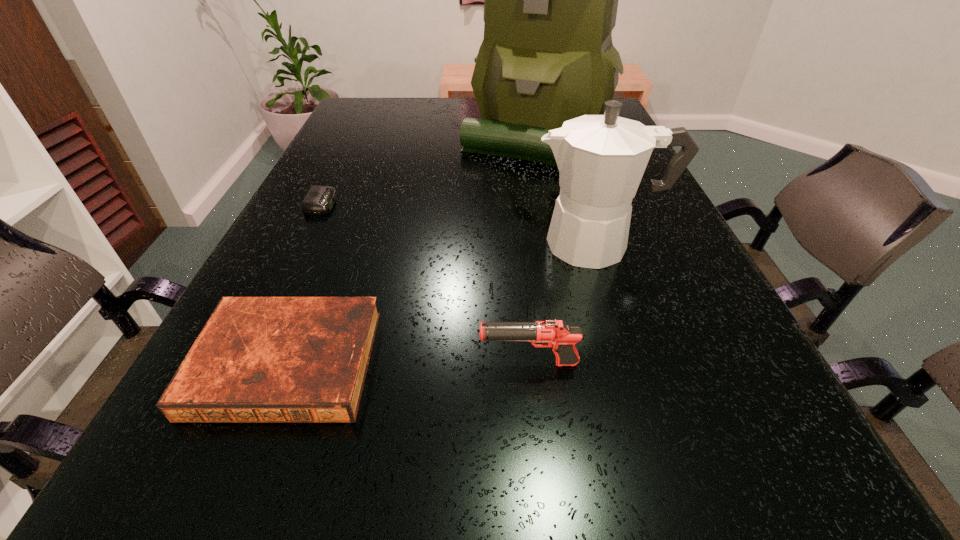
Locate an element on the screen. This screenshot has width=960, height=540. vacant area located at the spout of the third farthest object is located at coordinates (491, 244).

Locate an element on the screen. This screenshot has width=960, height=540. free space located 0.120m at the spout of the third farthest object is located at coordinates (470, 244).

I want to click on vacant space located at the aiming end of the third tallest object, so click(x=324, y=363).

Find the location of a particular element. This screenshot has height=540, width=960. vacant space located 0.160m at the aiming end of the third tallest object is located at coordinates (372, 363).

Locate an element on the screen. vacant area situated at the aiming end of the third tallest object is located at coordinates (412, 363).

The image size is (960, 540). Find the location of `vacant region located 0.050m on the spine side of the Bible`. vacant region located 0.050m on the spine side of the Bible is located at coordinates (248, 461).

What are the coordinates of `free space located 0.070m on the display of the shortest object` in the screenshot? It's located at (367, 204).

Locate an element on the screen. object present at the far edge is located at coordinates (550, 0).

Image resolution: width=960 pixels, height=540 pixels. Identify the location of Bible that is at the left edge. (258, 359).

Where is `alarm clock located at the left edge`? The image size is (960, 540). alarm clock located at the left edge is located at coordinates (319, 200).